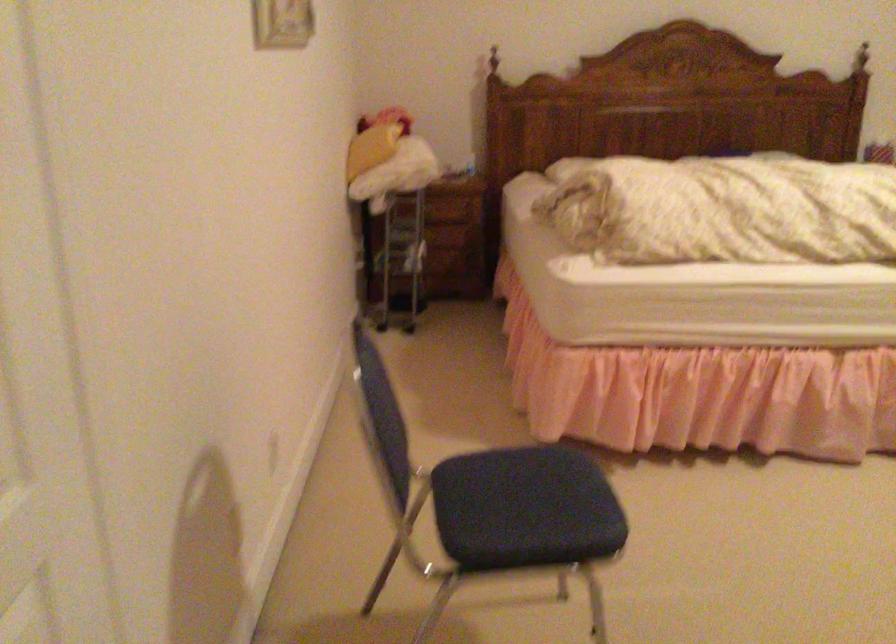
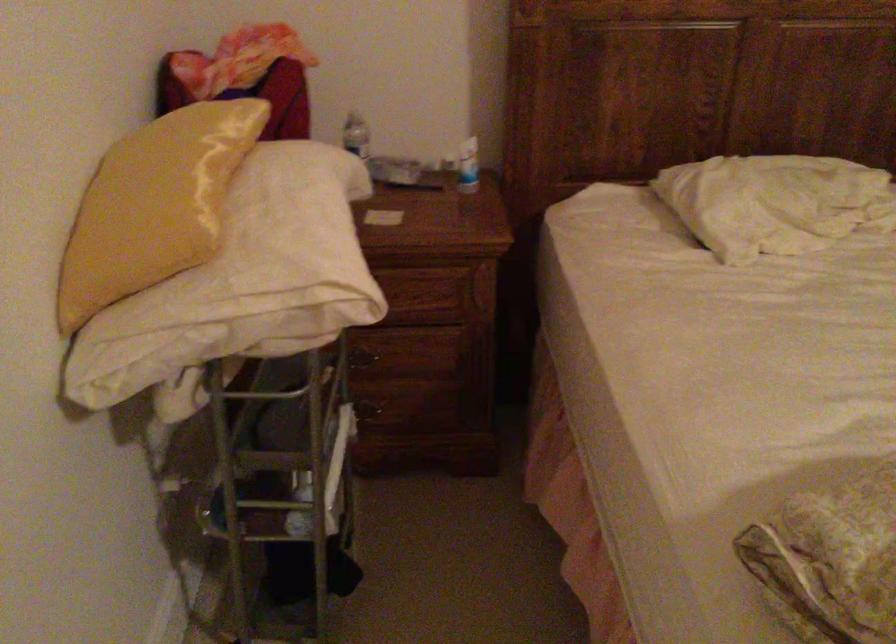
In the second image, find the point that corresponds to (x=443, y=234) in the first image.

(412, 365)